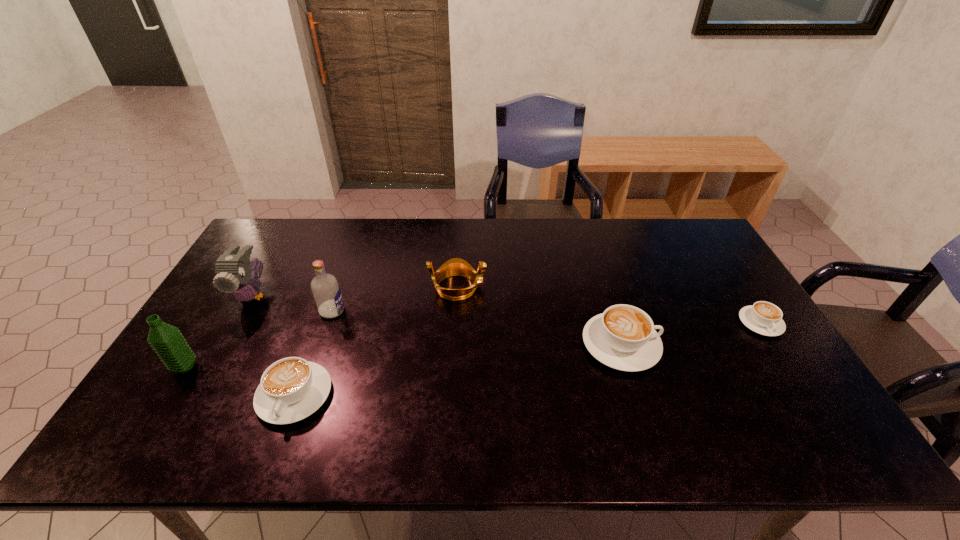
This screenshot has width=960, height=540. What are the coordinates of `free space between the sixth object from left to right and the vodka` in the screenshot? It's located at point(476,328).

Locate an element on the screen. This screenshot has height=540, width=960. vacant space that is in between the rightmost object and the second object from left to right is located at coordinates (507, 309).

Identify the location of object that stands as the closest to the second shortest object. Image resolution: width=960 pixels, height=540 pixels. (326, 291).

Choose which object is the nearest neighbor to the tiara. Please provide its 2D coordinates. Your answer should be formatted as a tuple, i.e. [(x, y)], where the tuple contains the x and y coordinates of a point satisfying the conditions above.

[(326, 291)]

What are the coordinates of `the second closest cappuccino to the second shortest object` in the screenshot? It's located at (765, 318).

Select which cappuccino appears as the second closest to the vodka. Please provide its 2D coordinates. Your answer should be formatted as a tuple, i.e. [(x, y)], where the tuple contains the x and y coordinates of a point satisfying the conditions above.

[(623, 337)]

Where is `vacant position in the image that satisfies the following two spatial constraints: 1. at the front emblem of the third object from right to left; 2. on the side of the leftmost cappuccino with the handle`? The image size is (960, 540). vacant position in the image that satisfies the following two spatial constraints: 1. at the front emblem of the third object from right to left; 2. on the side of the leftmost cappuccino with the handle is located at coordinates (451, 395).

This screenshot has width=960, height=540. Identify the location of vacant region that satisfies the following two spatial constraints: 1. at the front emblem of the tiara; 2. on the side of the second shortest object with the handle. (451, 395).

The width and height of the screenshot is (960, 540). In order to click on vacant area in the image that satisfies the following two spatial constraints: 1. at the front emblem of the third object from right to left; 2. on the side of the leftmost cappuccino with the handle in this screenshot , I will do `click(451, 395)`.

Where is `free location that satisfies the following two spatial constraints: 1. at the front emblem of the tiara; 2. at the beak of the second object from left to right`? The image size is (960, 540). free location that satisfies the following two spatial constraints: 1. at the front emblem of the tiara; 2. at the beak of the second object from left to right is located at coordinates (457, 295).